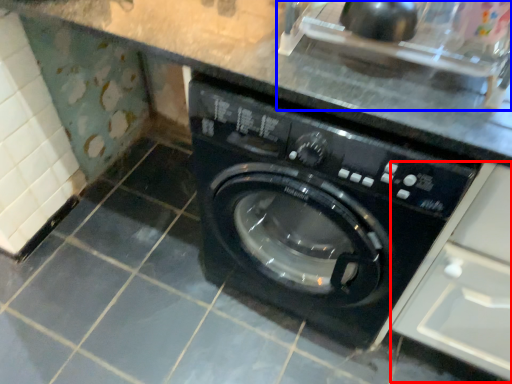
Question: Which of the following is the farthest to the observer, drawer (highlighted by a red box) or sink (highlighted by a blue box)?

Choices:
 (A) drawer
 (B) sink

Answer: (B)